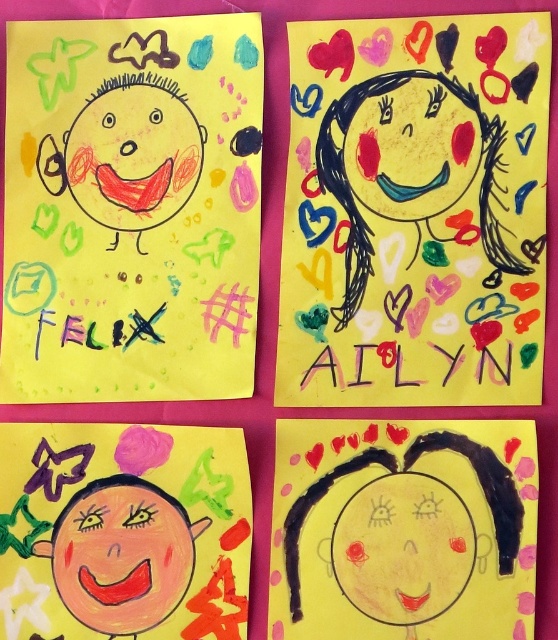
Looking at the image of childrens drawings, there is a pink matte face at center and a matte red face at upper left. Which one is located lower in the arrangement?

The pink matte face at center is positioned under the matte red face at upper left, so the pink matte face at center is lower.

From the picture: You are a teacher looking at the children drawings displayed in a 2x2 grid. You notice the matte black head at upper left and the smooth yellow face at upper center. Which of these two objects is bigger in size?

The matte black head at upper left is larger in size compared to the smooth yellow face at upper center.